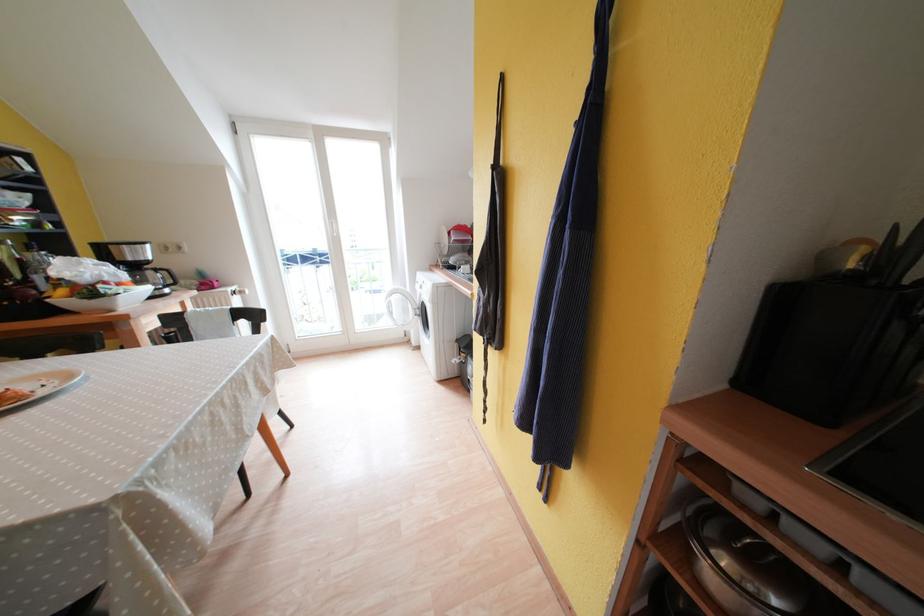
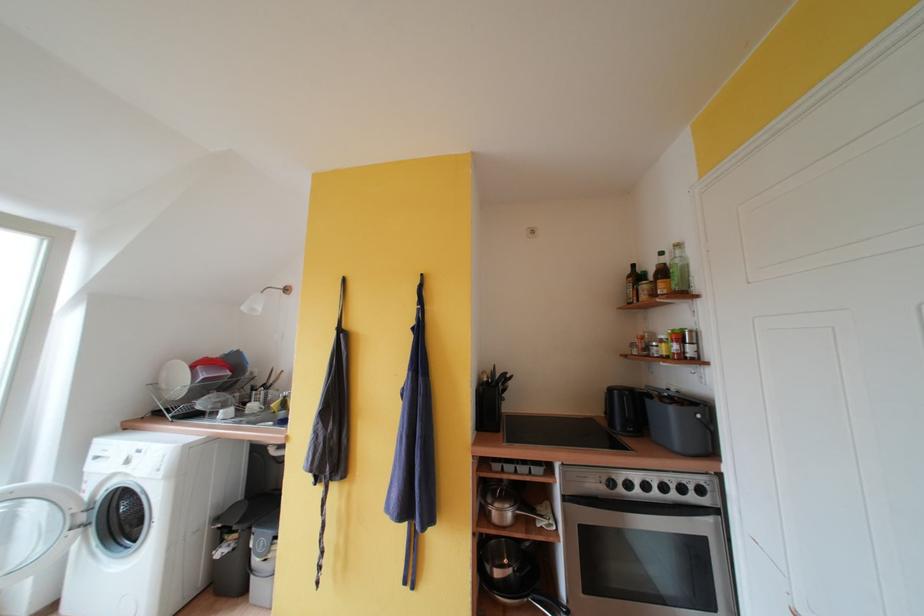
In the second image, find the point that corresponds to point (456, 236) in the first image.

(199, 371)